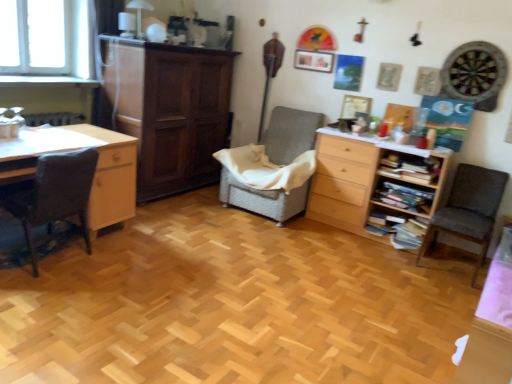
Find the location of `free space between light wood desk at left and dark gray fabric chair at left, the third chair from the right`. free space between light wood desk at left and dark gray fabric chair at left, the third chair from the right is located at coordinates (100, 246).